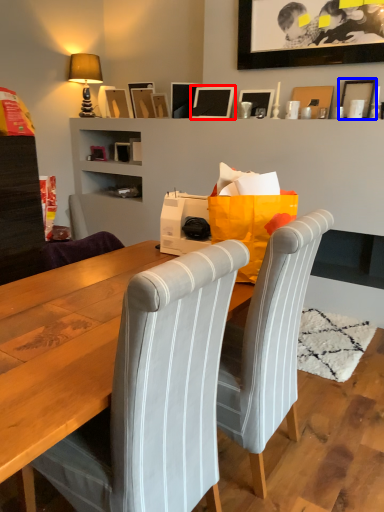
Question: Which object appears closest to the camera in this image, picture frame (highlighted by a red box) or picture frame (highlighted by a blue box)?

Choices:
 (A) picture frame
 (B) picture frame

Answer: (B)